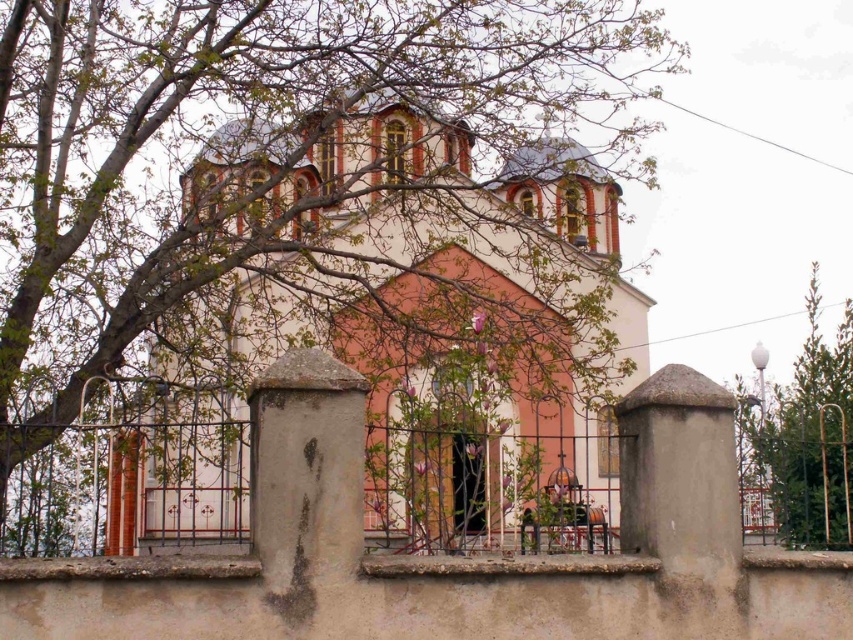
Can you confirm if bare branches at upper left is positioned below green leafy tree at right?

Actually, bare branches at upper left is above green leafy tree at right.

Does bare branches at upper left appear on the left side of green leafy tree at right?

Yes, bare branches at upper left is to the left of green leafy tree at right.

Looking at this image, measure the distance between bare branches at upper left and camera.

bare branches at upper left is 39.02 meters away from camera.

Find the location of a particular element. bare branches at upper left is located at coordinates (276, 161).